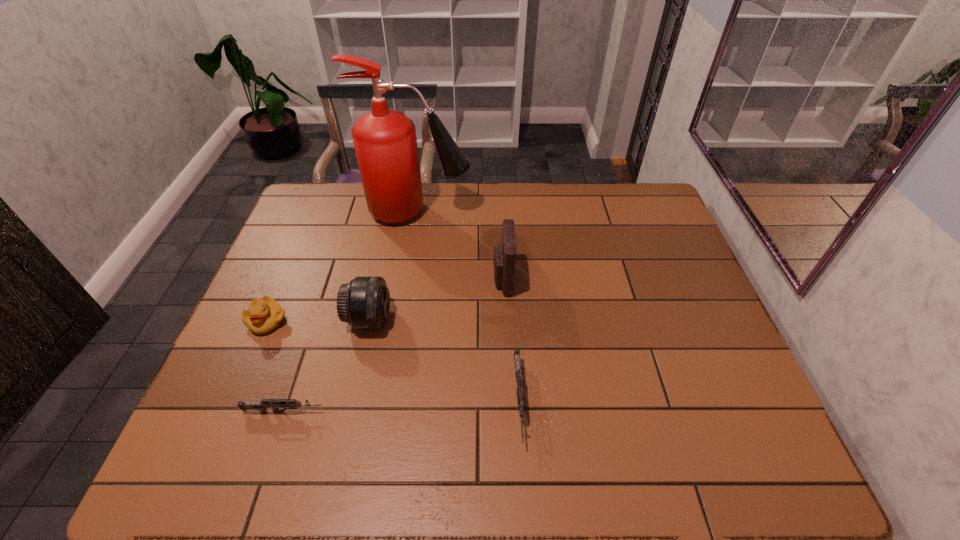
Where is `unoccupied position between the taller gun and the farthest object`? The width and height of the screenshot is (960, 540). unoccupied position between the taller gun and the farthest object is located at coordinates (468, 306).

Image resolution: width=960 pixels, height=540 pixels. I want to click on unoccupied position between the telephoto lens and the farthest object, so click(x=395, y=266).

Where is `free space between the duckling and the second shortest object`? free space between the duckling and the second shortest object is located at coordinates (393, 361).

Identify the location of free space between the shortest object and the right gun. (401, 407).

Where is `vacant space that's between the duckling and the telephoto lens`? This screenshot has height=540, width=960. vacant space that's between the duckling and the telephoto lens is located at coordinates (319, 320).

Locate an element on the screen. The height and width of the screenshot is (540, 960). free space between the fourth shortest object and the pouch is located at coordinates (436, 300).

Locate an element on the screen. The width and height of the screenshot is (960, 540). free point between the left gun and the pouch is located at coordinates (394, 346).

Identify the location of object that is the second closest to the pouch. This screenshot has height=540, width=960. (520, 395).

Identify the location of object that is the third closest to the third tallest object. (504, 261).

Image resolution: width=960 pixels, height=540 pixels. What are the coordinates of `free region that satisfies the following two spatial constraints: 1. aimed along the barrel of the fifth tallest object; 2. aimed along the barrel of the shortest object` in the screenshot? It's located at (519, 412).